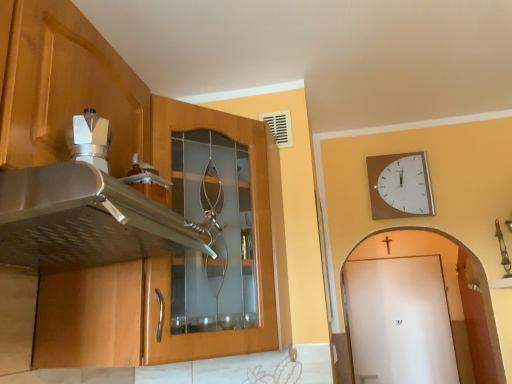
Question: Should I look upward or downward to see wooden cabinet at left?

Choices:
 (A) down
 (B) up

Answer: (A)

Question: Is white matte door at right further to camera compared to wooden cabinet at left?

Choices:
 (A) yes
 (B) no

Answer: (A)

Question: From the image's perspective, is white matte door at right located above wooden cabinet at left?

Choices:
 (A) yes
 (B) no

Answer: (B)

Question: Is the depth of white matte door at right less than that of wooden cabinet at left?

Choices:
 (A) yes
 (B) no

Answer: (B)

Question: Is there a large distance between white matte door at right and wooden cabinet at left?

Choices:
 (A) yes
 (B) no

Answer: (A)

Question: Is white matte door at right next to wooden cabinet at left and touching it?

Choices:
 (A) yes
 (B) no

Answer: (B)

Question: Considering the relative sizes of white matte door at right and wooden cabinet at left in the image provided, is white matte door at right taller than wooden cabinet at left?

Choices:
 (A) yes
 (B) no

Answer: (A)

Question: Would you consider wooden cabinet at left to be distant from wooden clock at upper right?

Choices:
 (A) no
 (B) yes

Answer: (B)

Question: Is wooden cabinet at left positioned before wooden clock at upper right?

Choices:
 (A) yes
 (B) no

Answer: (A)

Question: Is wooden cabinet at left next to wooden clock at upper right?

Choices:
 (A) yes
 (B) no

Answer: (B)

Question: From the image's perspective, would you say wooden cabinet at left is shown under wooden clock at upper right?

Choices:
 (A) yes
 (B) no

Answer: (A)

Question: Considering the relative sizes of wooden cabinet at left and wooden clock at upper right in the image provided, is wooden cabinet at left shorter than wooden clock at upper right?

Choices:
 (A) no
 (B) yes

Answer: (A)

Question: Is wooden cabinet at left further to camera compared to wooden clock at upper right?

Choices:
 (A) no
 (B) yes

Answer: (A)

Question: Is white matte door at right at the back of wooden clock at upper right?

Choices:
 (A) no
 (B) yes

Answer: (B)